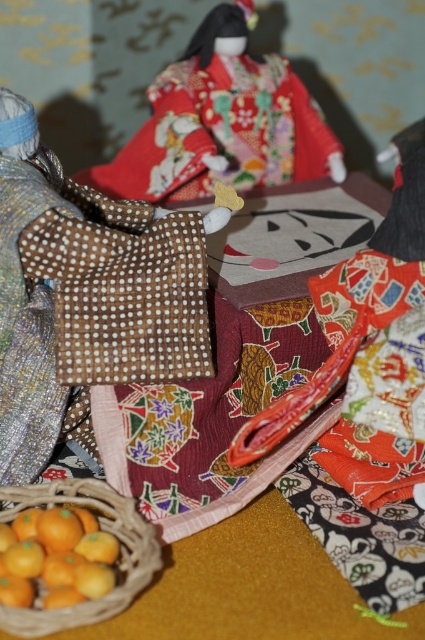
Question: Is silky red kimono at upper center below yellow matte oranges at lower left?

Choices:
 (A) yes
 (B) no

Answer: (B)

Question: Observing the image, what is the correct spatial positioning of silky red kimono at upper center in reference to yellow matte oranges at lower left?

Choices:
 (A) left
 (B) right

Answer: (B)

Question: Which of the following is the closest to the observer?

Choices:
 (A) (167, 116)
 (B) (37, 616)
 (C) (76, 330)
 (D) (59, 582)

Answer: (B)

Question: Which point is closer to the camera?

Choices:
 (A) brown dotted fabric bag at center
 (B) yellow matte oranges at lower left
 (C) silky red kimono at upper center

Answer: (B)

Question: Is silky red kimono at upper center smaller than brown woven basket at lower left?

Choices:
 (A) yes
 (B) no

Answer: (B)

Question: Which object is positioned closest to the brown woven basket at lower left?

Choices:
 (A) yellow matte oranges at lower left
 (B) silky red kimono at upper center

Answer: (A)